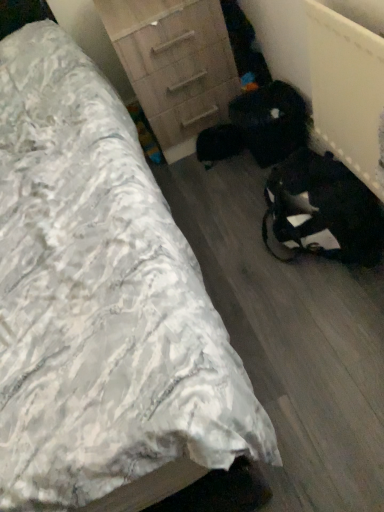
Question: From a real-world perspective, is wooden chest of drawers at center above or below white textured bed at center?

Choices:
 (A) below
 (B) above

Answer: (A)

Question: From the image's perspective, is wooden chest of drawers at center positioned above or below white textured bed at center?

Choices:
 (A) below
 (B) above

Answer: (B)

Question: Considering the relative positions of wooden chest of drawers at center and white textured bed at center in the image provided, is wooden chest of drawers at center to the left or to the right of white textured bed at center?

Choices:
 (A) left
 (B) right

Answer: (B)

Question: Is white textured bed at center in front of or behind wooden chest of drawers at center in the image?

Choices:
 (A) behind
 (B) front

Answer: (B)

Question: From a real-world perspective, is white textured bed at center above or below wooden chest of drawers at center?

Choices:
 (A) below
 (B) above

Answer: (B)

Question: Looking at the image, does white textured bed at center seem bigger or smaller compared to wooden chest of drawers at center?

Choices:
 (A) small
 (B) big

Answer: (B)

Question: In terms of width, does white textured bed at center look wider or thinner when compared to wooden chest of drawers at center?

Choices:
 (A) thin
 (B) wide

Answer: (B)